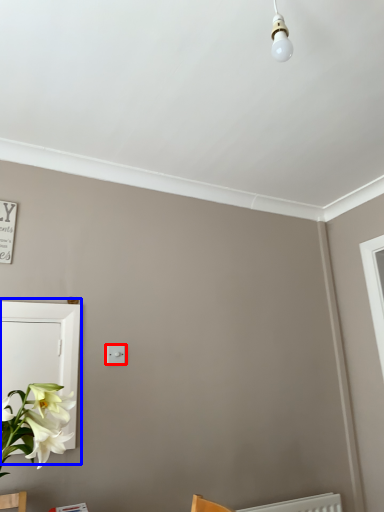
Question: Which of the following is the farthest to the observer, light switch (highlighted by a red box) or medicine cabinet (highlighted by a blue box)?

Choices:
 (A) light switch
 (B) medicine cabinet

Answer: (A)